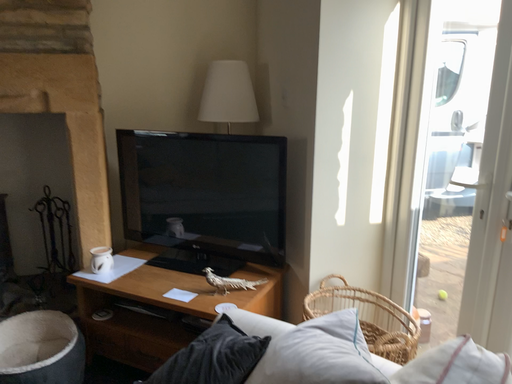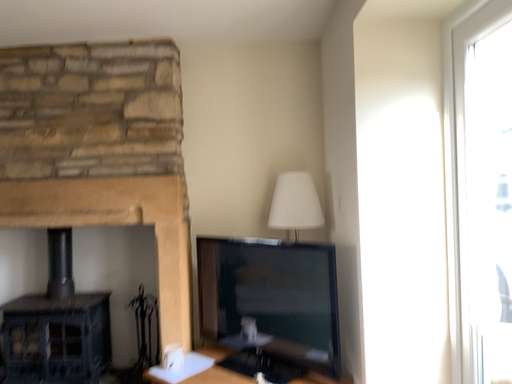
Question: Which way did the camera rotate in the video?

Choices:
 (A) rotated upward
 (B) rotated downward

Answer: (A)